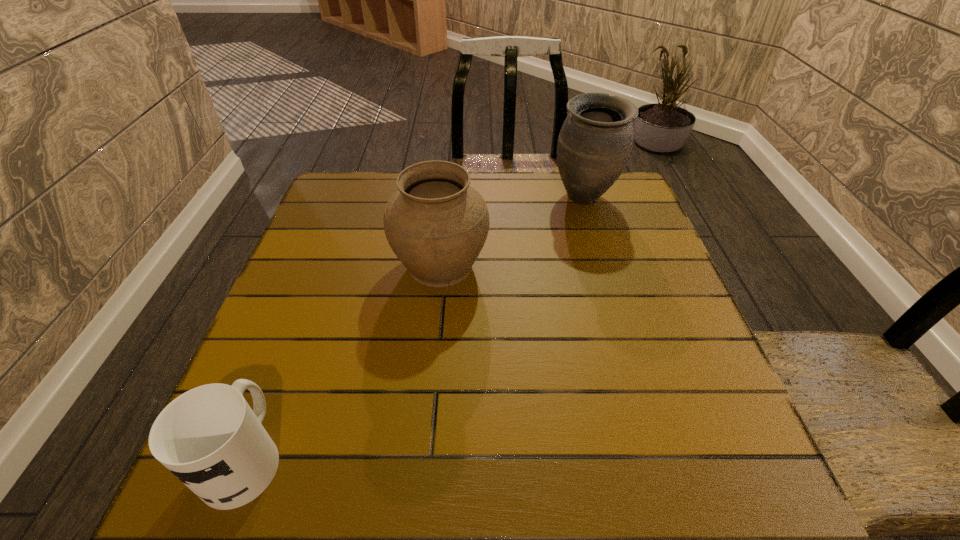
Identify the location of vacant region that satisfies the following two spatial constraints: 1. on the handle side of the shortest object; 2. on the left side of the rightmost object. (346, 198).

This screenshot has height=540, width=960. In order to click on free space that satisfies the following two spatial constraints: 1. on the handle side of the nearest object; 2. on the right side of the rightmost object in this screenshot , I will do click(346, 198).

This screenshot has height=540, width=960. I want to click on free space in the image that satisfies the following two spatial constraints: 1. on the handle side of the second farthest object; 2. on the left side of the shortest object, so click(x=319, y=265).

You are a GUI agent. You are given a task and a screenshot of the screen. Output one action in this format:
    pyautogui.click(x=<x>, y=<y>)
    Task: Click on the free space that satisfies the following two spatial constraints: 1. on the handle side of the rightmost object; 2. on the left side of the leftmost object
    
    Given the screenshot: What is the action you would take?
    pyautogui.click(x=346, y=198)

What are the coordinates of `blank space that satisfies the following two spatial constraints: 1. on the back side of the right urn; 2. on the left side of the second object from left to right` in the screenshot? It's located at (447, 198).